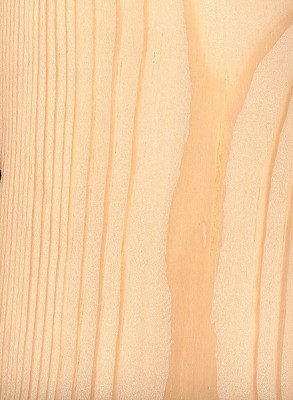
You are a GUI agent. You are given a task and a screenshot of the screen. Output one action in this format:
    pyautogui.click(x=<x>, y=<y>)
    Task: Click on the bottom right corner of wood
    The image size is (293, 400).
    Given the screenshot: What is the action you would take?
    pyautogui.click(x=288, y=396)